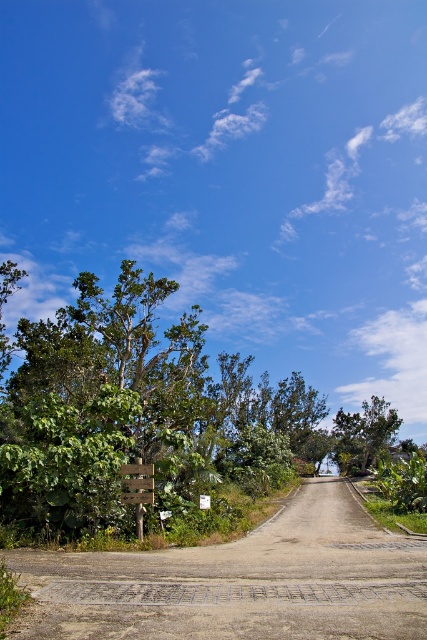
Does brown gravel road at center have a smaller size compared to wooden sign at center?

No.

Does point (377, 531) come in front of point (146, 500)?

No, (377, 531) is behind (146, 500).

In order to click on brown gravel road at center in this screenshot , I will do `click(239, 582)`.

Identify the location of brown gravel road at center. (239, 582).

Is green leafy tree at left bigger than brown gravel road at center?

Yes, green leafy tree at left is bigger than brown gravel road at center.

Does green leafy tree at left appear on the right side of brown gravel road at center?

Incorrect, green leafy tree at left is not on the right side of brown gravel road at center.

What do you see at coordinates (151, 416) in the screenshot? The height and width of the screenshot is (640, 427). I see `green leafy tree at left` at bounding box center [151, 416].

Locate an element on the screen. green leafy tree at left is located at coordinates (151, 416).

Between green leafy tree at center and wooden sign at center, which one is positioned lower?

Positioned lower is green leafy tree at center.

In the scene shown: Is green leafy tree at center positioned behind wooden sign at center?

Yes, green leafy tree at center is further from the viewer.

Between point (397, 426) and point (131, 465), which one is positioned behind?

Positioned behind is point (397, 426).

Where is `green leafy tree at center`? The height and width of the screenshot is (640, 427). green leafy tree at center is located at coordinates (362, 435).